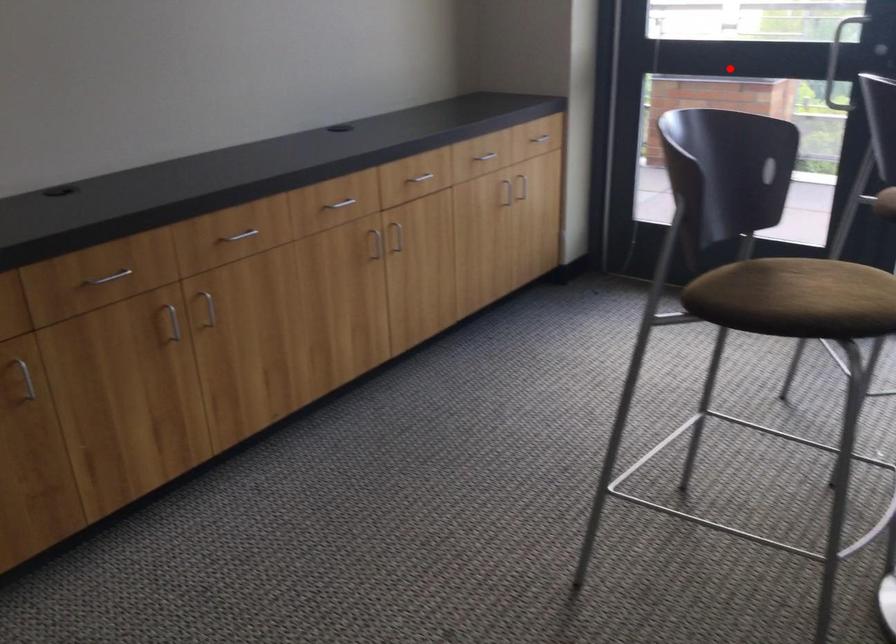
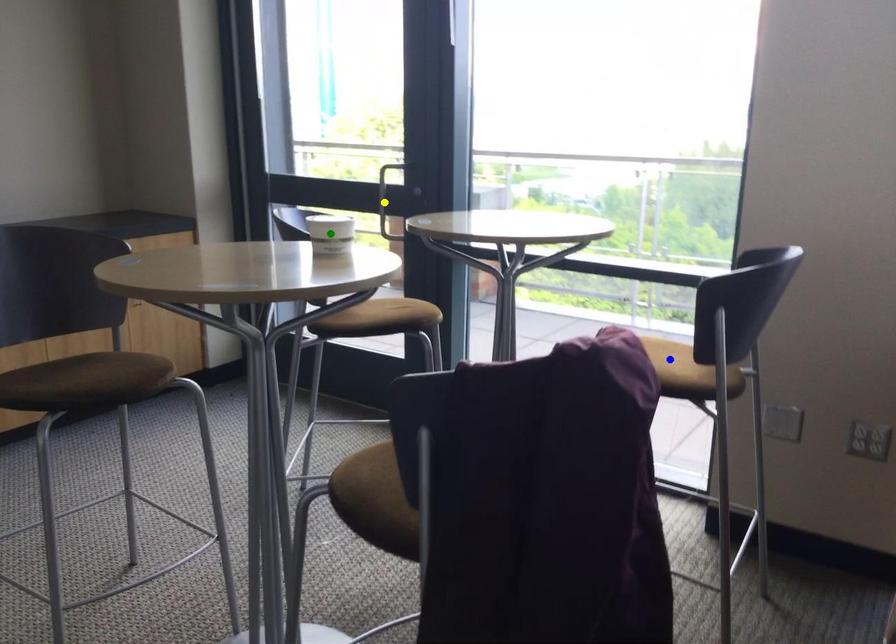
Question: I am providing you with two images of the same scene from different viewpoints. A red point is marked on the first image. You are given multiple points on the second image. Can you choose the point in image 2 that corresponds to the point in image 1?

Choices:
 (A) yellow point
 (B) blue point
 (C) green point

Answer: (A)